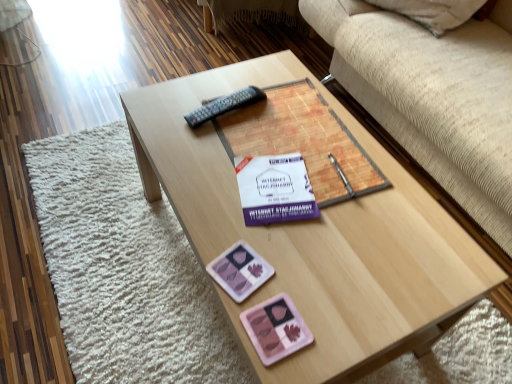
Image resolution: width=512 pixels, height=384 pixels. Find the location of `free spot behind white paper at center`. free spot behind white paper at center is located at coordinates (280, 140).